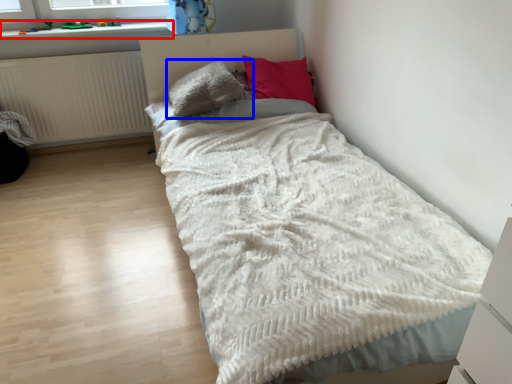
Question: Which point is further to the camera, window sill (highlighted by a red box) or pillow (highlighted by a blue box)?

Choices:
 (A) window sill
 (B) pillow

Answer: (A)